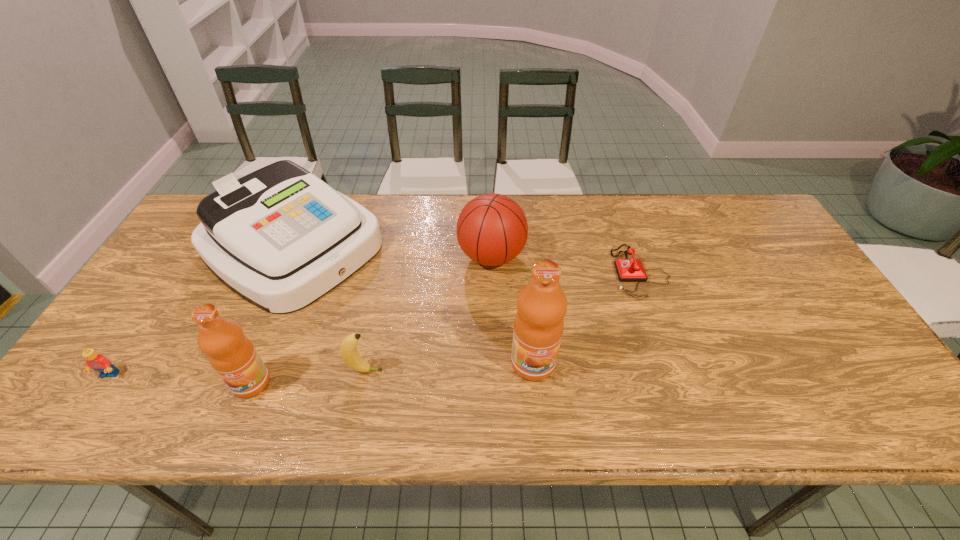
I want to click on cash register present at the left edge, so click(280, 238).

Locate an element on the screen. The image size is (960, 540). Lego present at the left edge is located at coordinates [98, 362].

Image resolution: width=960 pixels, height=540 pixels. Find the location of `object located at the far left corner`. object located at the far left corner is located at coordinates (280, 238).

At what (x,y) coordinates should I click in order to perform the action: click on object that is at the near left corner. Please return your answer as a coordinate pair (x, y). Looking at the image, I should click on (98, 362).

The width and height of the screenshot is (960, 540). I want to click on free region at the far edge of the desktop, so click(405, 215).

In the image, there is a desktop. In order to click on free space at the near edge in this screenshot , I will do `click(457, 359)`.

The width and height of the screenshot is (960, 540). In the image, there is a desktop. What are the coordinates of `free space at the left edge` in the screenshot? It's located at (171, 345).

In order to click on free region at the right edge in this screenshot , I will do `click(805, 320)`.

What are the coordinates of `free space between the banana and the taller fruit juice` in the screenshot? It's located at pyautogui.click(x=449, y=367).

Where is `free point between the cash register and the telephone`? This screenshot has height=540, width=960. free point between the cash register and the telephone is located at coordinates (467, 260).